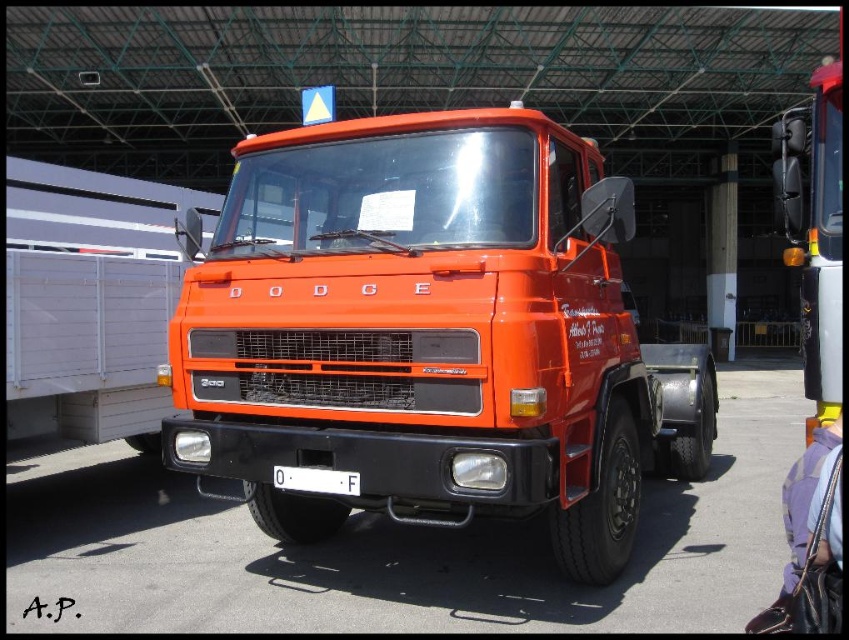
Question: Which object is farther from the camera taking this photo?

Choices:
 (A) orange matte truck at center
 (B) white plastic license plate at center

Answer: (B)

Question: Can you confirm if orange matte truck at center is wider than white plastic license plate at center?

Choices:
 (A) no
 (B) yes

Answer: (B)

Question: Can you confirm if orange matte truck at center is positioned below white plastic license plate at center?

Choices:
 (A) yes
 (B) no

Answer: (B)

Question: Can you confirm if orange matte truck at center is bigger than white plastic license plate at center?

Choices:
 (A) no
 (B) yes

Answer: (B)

Question: Which of the following is the closest to the observer?

Choices:
 (A) pos(217,314)
 (B) pos(350,483)

Answer: (B)